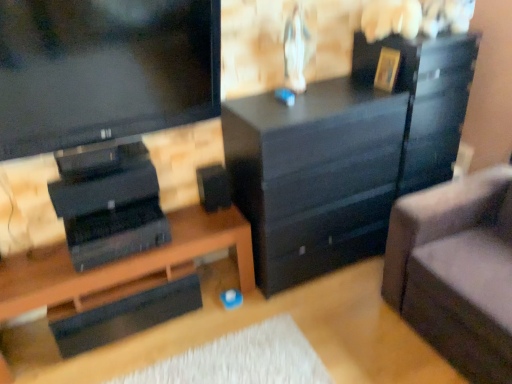
Image resolution: width=512 pixels, height=384 pixels. I want to click on vacant area in front of black matte speaker at center, so click(209, 226).